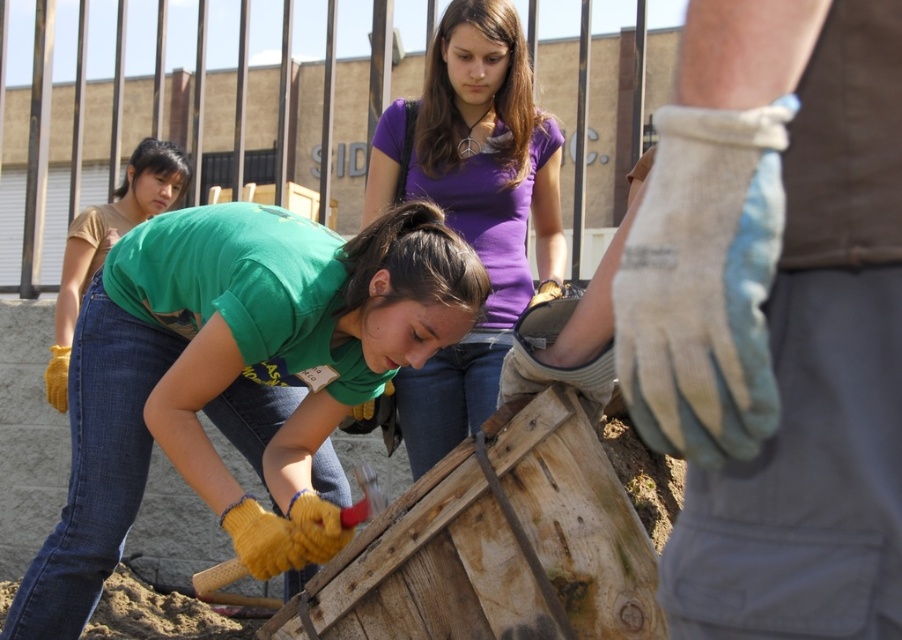
You are standing in front of the wooden structure being worked on. Which object is closer to you, the matte yellow gloves at lower left or the purple cotton shirt at upper center?

The matte yellow gloves at lower left is closer to the viewer than the purple cotton shirt at upper center.